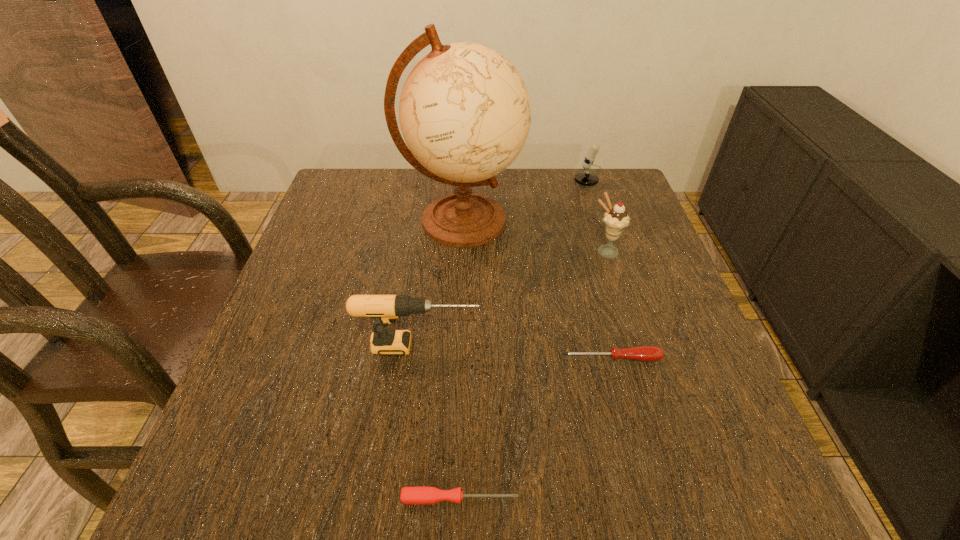
This screenshot has height=540, width=960. I want to click on vacant area in the image that satisfies the following two spatial constraints: 1. on the back side of the icecream; 2. on the surface of the tallest object, so click(596, 221).

Where is `vacant area in the image that satisfies the following two spatial constraints: 1. on the surface of the globe; 2. on the left side of the icecream`? This screenshot has height=540, width=960. vacant area in the image that satisfies the following two spatial constraints: 1. on the surface of the globe; 2. on the left side of the icecream is located at coordinates (460, 252).

This screenshot has height=540, width=960. I want to click on free spot that satisfies the following two spatial constraints: 1. on the back side of the icecream; 2. on the surface of the globe, so click(596, 221).

Locate an element on the screen. free location that satisfies the following two spatial constraints: 1. on the surface of the icecream; 2. on the left side of the tallest object is located at coordinates (460, 252).

The width and height of the screenshot is (960, 540). Identify the location of free space in the image that satisfies the following two spatial constraints: 1. on the handle side of the drill; 2. on the back side of the farther screwdriver. (418, 358).